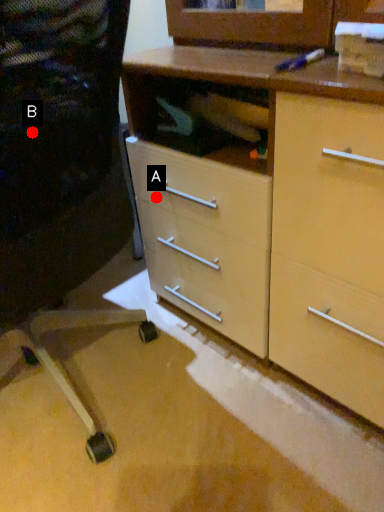
Question: Two points are circled on the image, labeled by A and B beside each circle. Which of the following is the closest to the observer?

Choices:
 (A) A is closer
 (B) B is closer

Answer: (B)